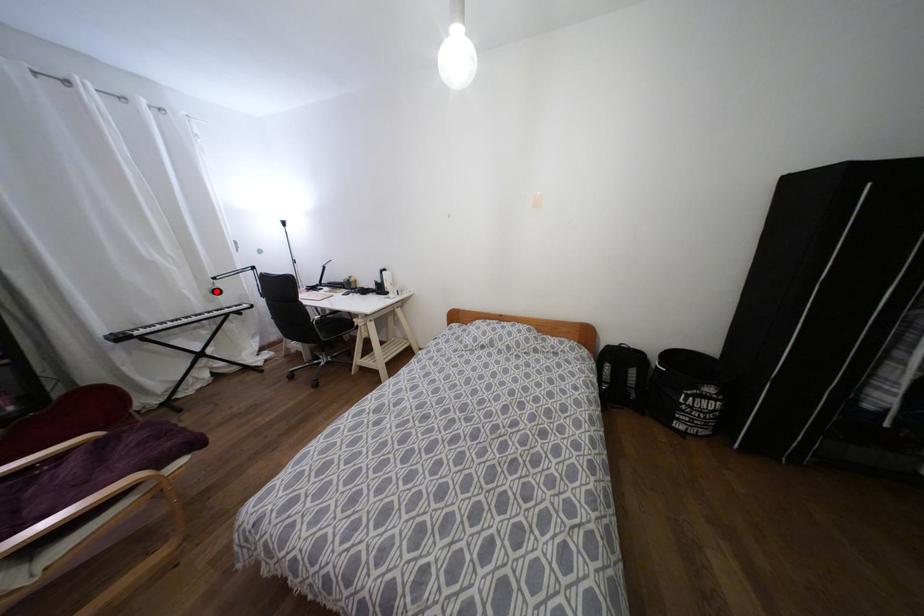
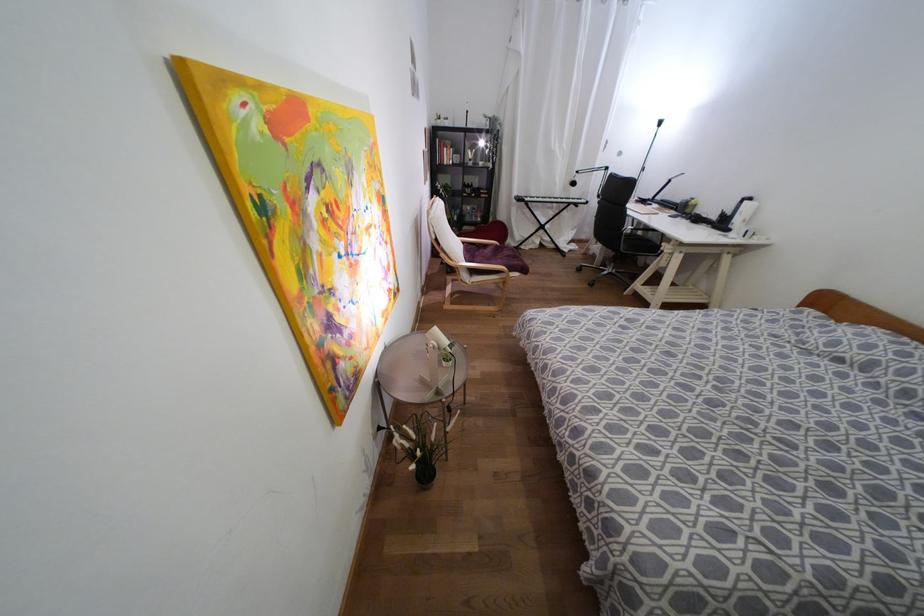
Question: I am providing you with two images of the same scene from different viewpoints. A red point is marked on the first image. Can you still see the location of the red point in image 2?

Choices:
 (A) Yes
 (B) No

Answer: (A)